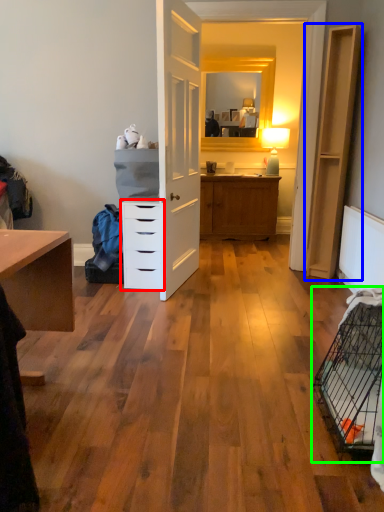
Question: Which object is the closest to the chest of drawers (highlighted by a red box)? Choose among these: file cabinet (highlighted by a blue box) or bird cage (highlighted by a green box).

Choices:
 (A) file cabinet
 (B) bird cage

Answer: (A)